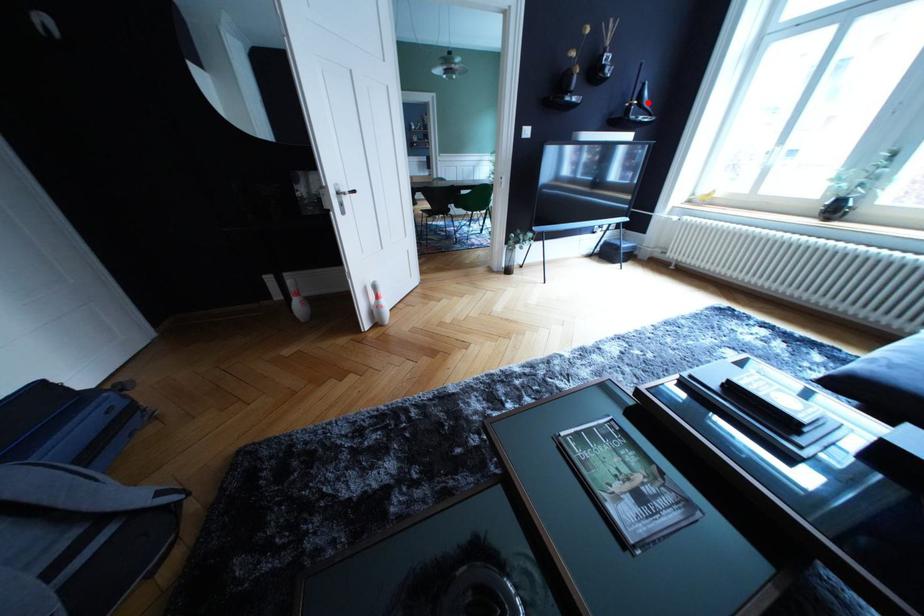
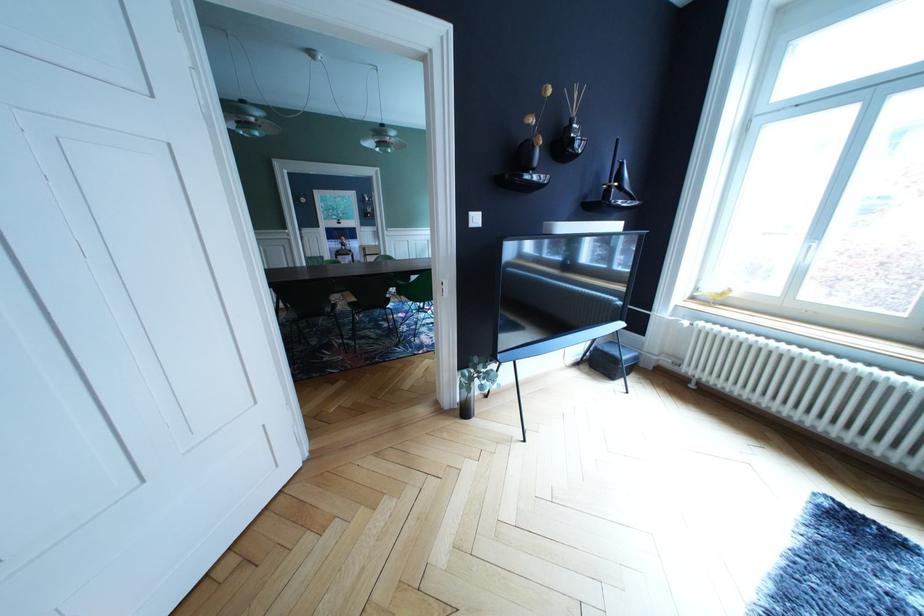
Locate, in the second image, the point that corresponds to the highlighted location in the first image.

(628, 184)